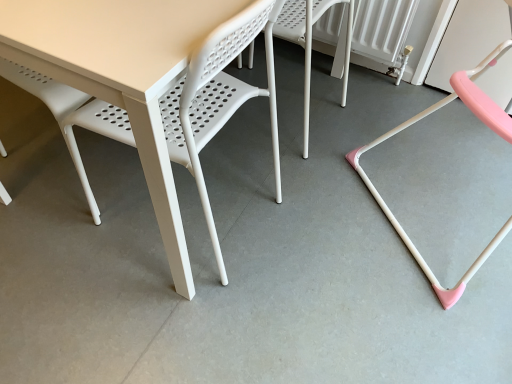
Find the location of a particular element. Image resolution: width=512 pixels, height=384 pixels. unoccupied area in front of white plastic chair at center, the second chair viewed from the right is located at coordinates (303, 180).